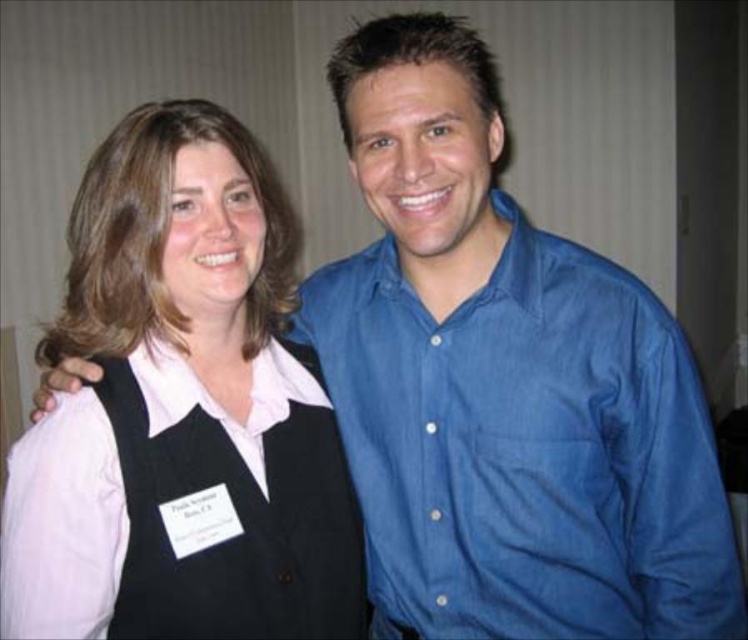
Question: Considering the real-world distances, which object is closest to the blue denim shirt at right?

Choices:
 (A) black matte vest at center
 (B) black fabric vest at center

Answer: (B)

Question: Among these points, which one is nearest to the camera?

Choices:
 (A) (285, 456)
 (B) (328, 540)

Answer: (A)

Question: Is black matte vest at center to the right of black fabric vest at center from the viewer's perspective?

Choices:
 (A) yes
 (B) no

Answer: (B)

Question: Is black matte vest at center below blue denim shirt at right?

Choices:
 (A) yes
 (B) no

Answer: (B)

Question: Which point appears closest to the camera in this image?

Choices:
 (A) (319, 483)
 (B) (521, 394)
 (C) (73, 228)

Answer: (B)

Question: Does black matte vest at center appear under black fabric vest at center?

Choices:
 (A) no
 (B) yes

Answer: (A)